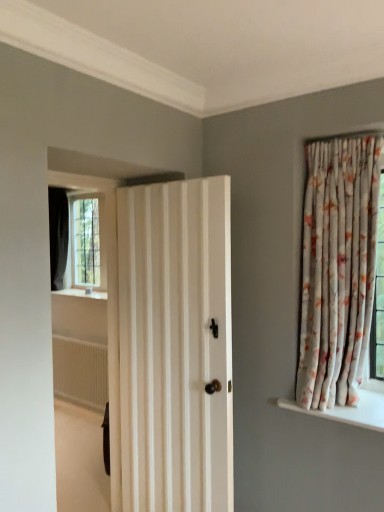
At what (x,y) coordinates should I click in order to perform the action: click on floral fabric curtain at right. Please return your answer as a coordinate pair (x, y). Looking at the image, I should click on (337, 268).

What do you see at coordinates (337, 268) in the screenshot? I see `floral fabric curtain at right` at bounding box center [337, 268].

Where is `floral fabric curtain at right`? The height and width of the screenshot is (512, 384). floral fabric curtain at right is located at coordinates (337, 268).